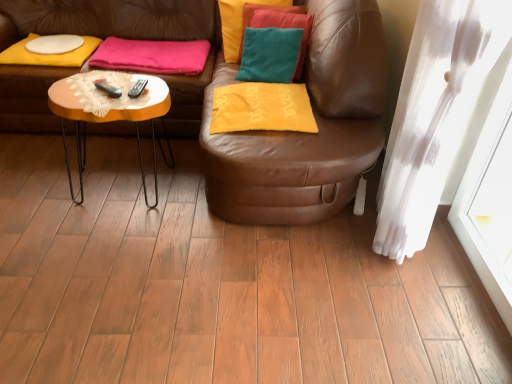
Describe the element at coordinates (298, 133) in the screenshot. Image resolution: width=512 pixels, height=384 pixels. I see `brown leather couch at center` at that location.

Locate an element on the screen. The image size is (512, 384). brown leather couch at center is located at coordinates (298, 133).

This screenshot has width=512, height=384. Find the location of `brown leather couch at center`. brown leather couch at center is located at coordinates (298, 133).